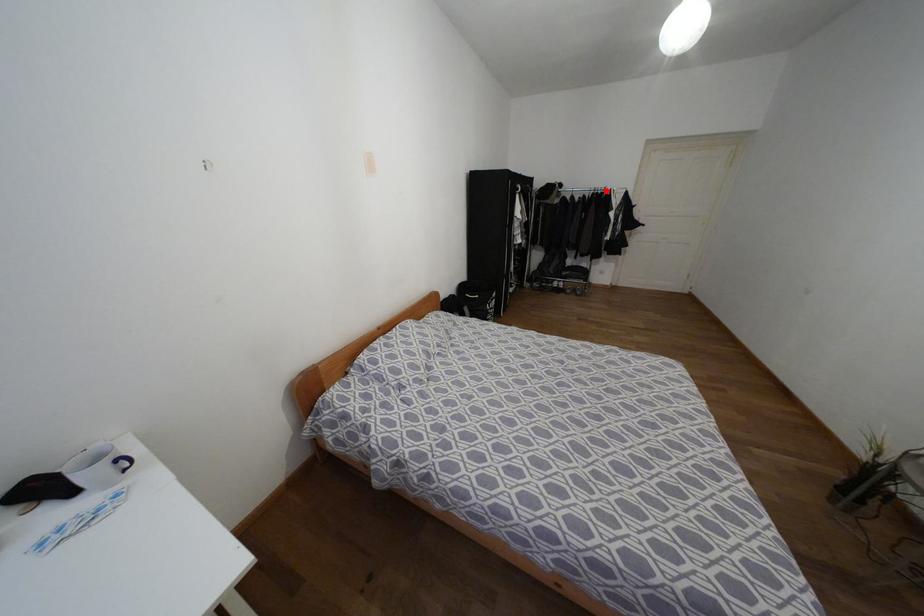
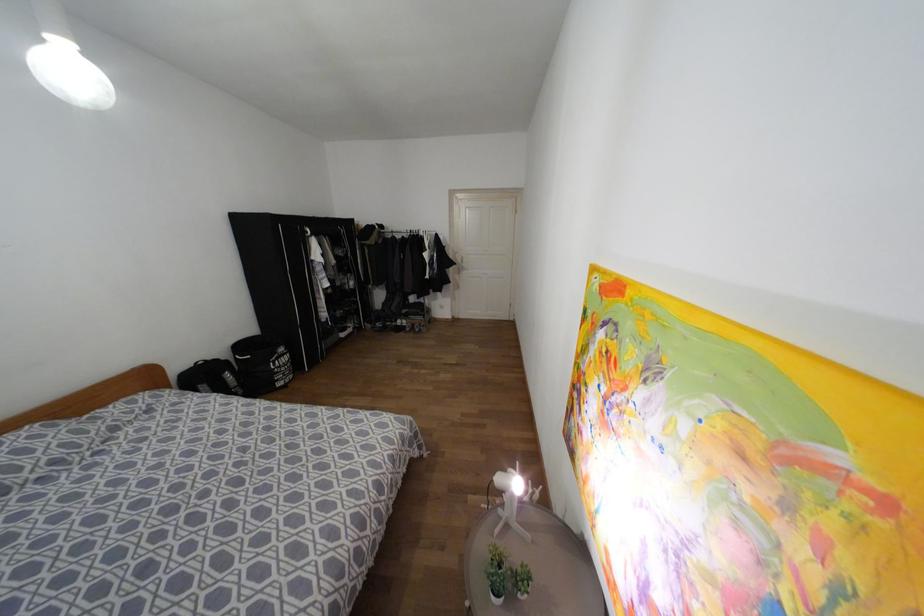
Find the pixel in the second image that matches the highlighted location in the first image.

(419, 233)